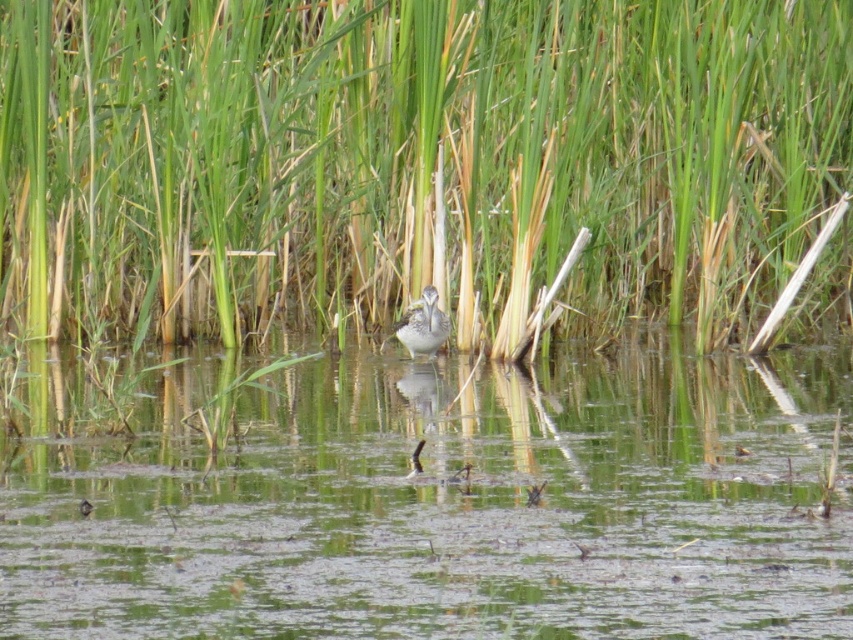
You are a photographer aiming to capture the bird in the wetland scene. The bird is at the center of the image. There is a green grass at center marked by point (422, 163). How does the position of the green grass at center relate to the bird?

The green grass at center marked by point (422, 163) is located at the same position as the bird, meaning they are both at the center of the image.

You are a photographer trying to capture the speckled gray bird at center and the green grass at center in a single shot. Which object will appear wider in the photo?

The speckled gray bird at center will appear wider in the photo since its width is greater than the green grass at center.